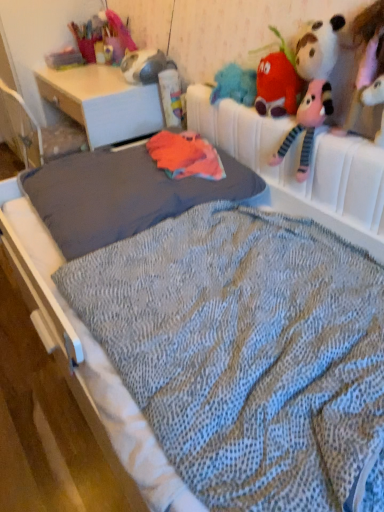
Question: From the image's perspective, is knitted plush strawberry at upper right, which ranks as the 1th toy in back-to-front order, located beneath matte white desk at center?

Choices:
 (A) yes
 (B) no

Answer: (A)

Question: Does knitted plush strawberry at upper right, marked as the second toy in a right-to-left arrangement, have a lesser width compared to matte white desk at center?

Choices:
 (A) yes
 (B) no

Answer: (A)

Question: From a real-world perspective, is knitted plush strawberry at upper right, the first toy when ordered from left to right, physically above matte white desk at center?

Choices:
 (A) yes
 (B) no

Answer: (A)

Question: Is knitted plush strawberry at upper right, the first toy when ordered from left to right, not inside matte white desk at center?

Choices:
 (A) no
 (B) yes

Answer: (B)

Question: From the image's perspective, is knitted plush strawberry at upper right, marked as the second toy in a right-to-left arrangement, over matte white desk at center?

Choices:
 (A) yes
 (B) no

Answer: (B)

Question: Considering the relative positions of knitted plush strawberry at upper right, marked as the second toy in a right-to-left arrangement, and matte white desk at center in the image provided, is knitted plush strawberry at upper right, marked as the second toy in a right-to-left arrangement, to the right of matte white desk at center from the viewer's perspective?

Choices:
 (A) no
 (B) yes

Answer: (B)

Question: Can you confirm if gray fabric mattress at center is shorter than knitted plush strawberry at upper right, the first toy when ordered from left to right?

Choices:
 (A) no
 (B) yes

Answer: (B)

Question: Would you consider gray fabric mattress at center to be distant from knitted plush strawberry at upper right, which ranks as the 1th toy in back-to-front order?

Choices:
 (A) no
 (B) yes

Answer: (A)

Question: Is gray fabric mattress at center oriented away from knitted plush strawberry at upper right, the first toy when ordered from left to right?

Choices:
 (A) no
 (B) yes

Answer: (A)

Question: Can you confirm if gray fabric mattress at center is smaller than knitted plush strawberry at upper right, marked as the second toy in a right-to-left arrangement?

Choices:
 (A) yes
 (B) no

Answer: (B)

Question: From the image's perspective, is gray fabric mattress at center located above knitted plush strawberry at upper right, which appears as the 2th toy when viewed from the front?

Choices:
 (A) no
 (B) yes

Answer: (A)

Question: Considering the relative sizes of gray fabric mattress at center and knitted plush strawberry at upper right, which appears as the 2th toy when viewed from the front, in the image provided, is gray fabric mattress at center bigger than knitted plush strawberry at upper right, which appears as the 2th toy when viewed from the front,?

Choices:
 (A) no
 (B) yes

Answer: (B)

Question: Are knitted plush strawberry at upper right, which ranks as the 1th toy in back-to-front order, and white plush toy at upper right, acting as the 2th toy starting from the left, located far from each other?

Choices:
 (A) no
 (B) yes

Answer: (A)